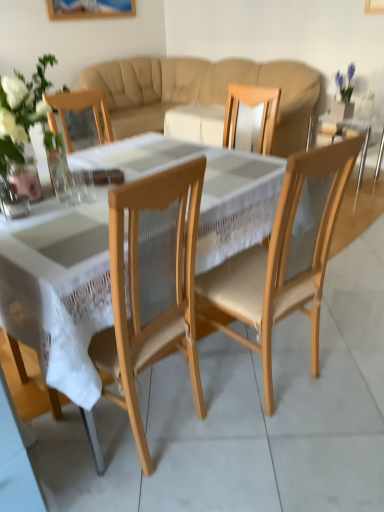
Where is `vacant area that lies between transparent glass at center, the 2th tableware in the left-to-right sequence, and clear glass vase at left`? vacant area that lies between transparent glass at center, the 2th tableware in the left-to-right sequence, and clear glass vase at left is located at coordinates (55, 200).